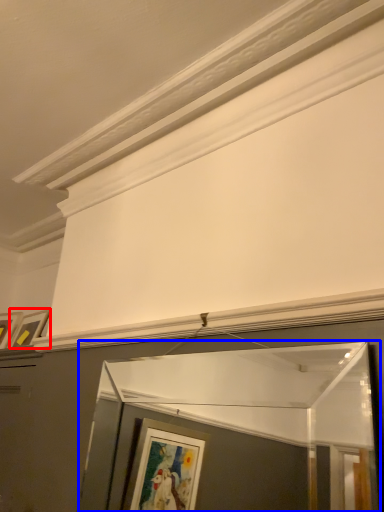
Question: Among these objects, which one is farthest to the camera, picture frame (highlighted by a red box) or window frame (highlighted by a blue box)?

Choices:
 (A) picture frame
 (B) window frame

Answer: (A)